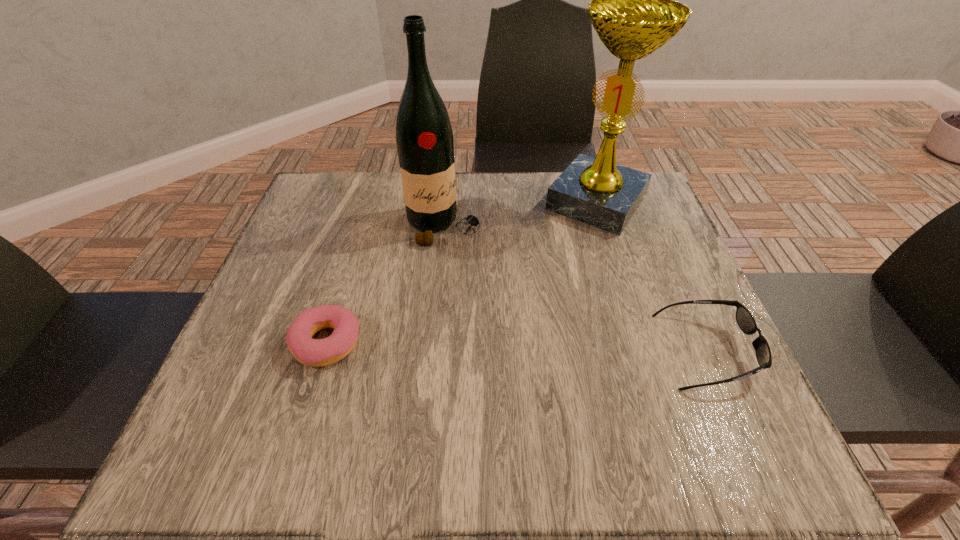
Where is `vacant space on the desktop that is between the leftmost object and the third tallest object and is positioned on the front-facing side of the award`? vacant space on the desktop that is between the leftmost object and the third tallest object and is positioned on the front-facing side of the award is located at coordinates (487, 347).

This screenshot has height=540, width=960. Identify the location of vacant space on the desktop that is between the leftmost object and the sunglasses and is positioned on the surface of the third object from right to left. pos(533,347).